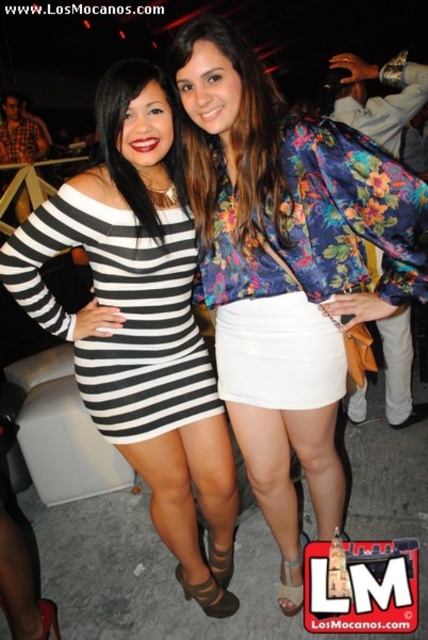
Does black matte dress at center have a lesser width compared to floral fabric blouse at center?

Incorrect, black matte dress at center's width is not less than floral fabric blouse at center's.

Based on the photo, is black matte dress at center taller than floral fabric blouse at center?

Yes, black matte dress at center is taller than floral fabric blouse at center.

The height and width of the screenshot is (640, 428). What do you see at coordinates (140, 323) in the screenshot? I see `black matte dress at center` at bounding box center [140, 323].

Image resolution: width=428 pixels, height=640 pixels. Identify the location of black matte dress at center. (140, 323).

Can you confirm if black and white striped dress at center is positioned to the left of floral fabric blouse at center?

Yes, black and white striped dress at center is to the left of floral fabric blouse at center.

Is point (190, 232) less distant than point (244, 116)?

No.

Locate an element on the screen. black and white striped dress at center is located at coordinates (122, 312).

Looking at this image, between floral satin blouse at center and black and white striped dress at center, which one has less height?

With less height is black and white striped dress at center.

Which is more to the right, floral satin blouse at center or black and white striped dress at center?

floral satin blouse at center is more to the right.

Is point (255, 385) less distant than point (151, 401)?

Yes, point (255, 385) is closer to viewer.

The width and height of the screenshot is (428, 640). I want to click on floral satin blouse at center, so (288, 268).